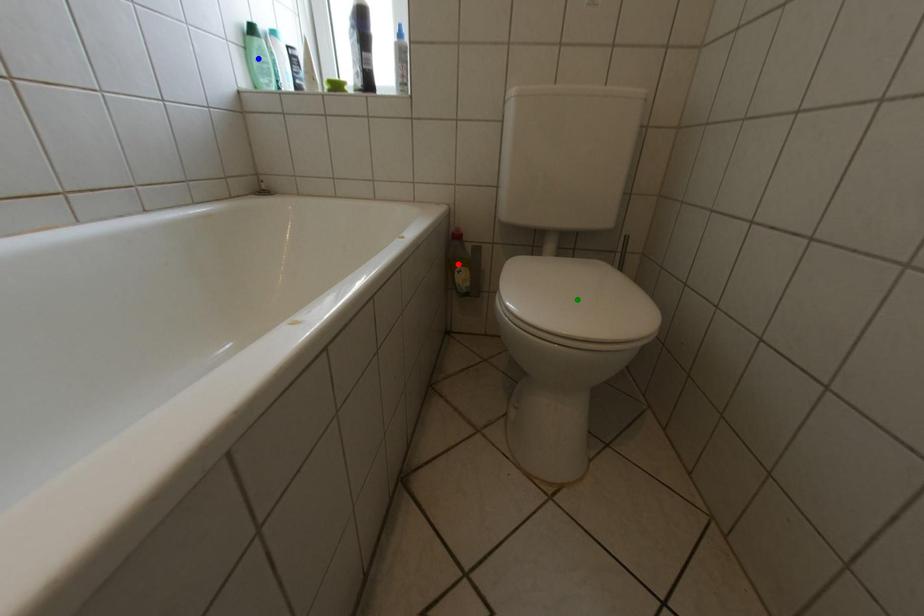
Order these from nearest to farthest:
A) blue point
B) red point
C) green point

green point, blue point, red point